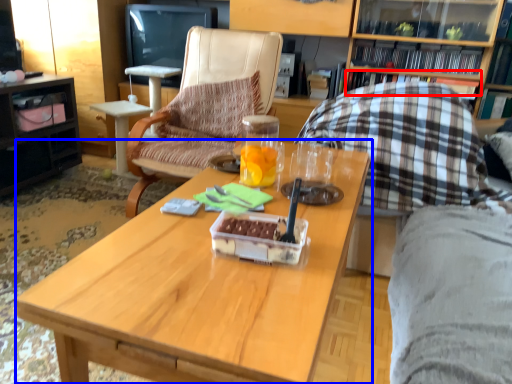
Question: Which object appears farthest to the camera in this image, book (highlighted by a red box) or coffee table (highlighted by a blue box)?

Choices:
 (A) book
 (B) coffee table

Answer: (A)